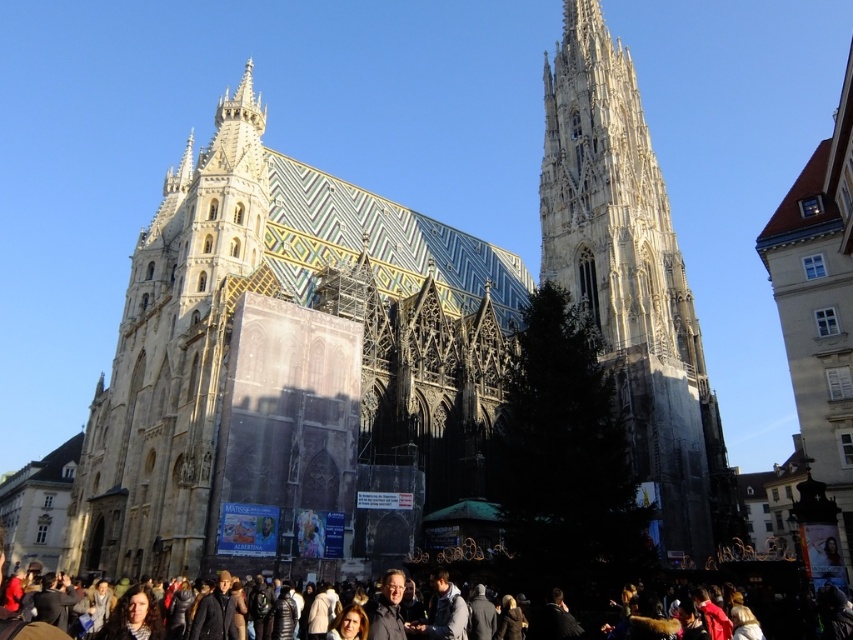
You are standing in front of the grand Gothic cathedral and want to take a photo of the point at coordinate (698, 451). If your camera has a maximum focus range of 80 meters, will you be able to focus on that point?

The point at coordinate (698, 451) is 83.77 meters away from the camera, which exceeds the camera maximum focus range of 80 meters. Therefore, you won not be able to focus on that point.

You are a tourist standing in front of the cathedral and want to take a photo that includes both the white stone tower at center and the dark gray clothing at center. Which object should you zoom in on to ensure both fit in the frame?

You should zoom in on the white stone tower at center because its width is narrower than the dark gray clothing at center, allowing both to fit within the frame when focusing on the narrower object.